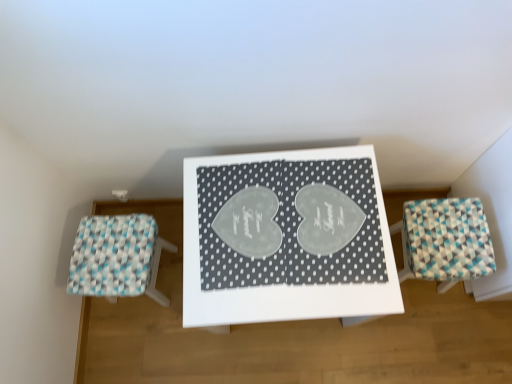
Where is `vacant region above teal-patterned stool at right, which is the 1th furniture in right-to-left order (from a real-world perspective)`? The height and width of the screenshot is (384, 512). vacant region above teal-patterned stool at right, which is the 1th furniture in right-to-left order (from a real-world perspective) is located at coordinates (451, 236).